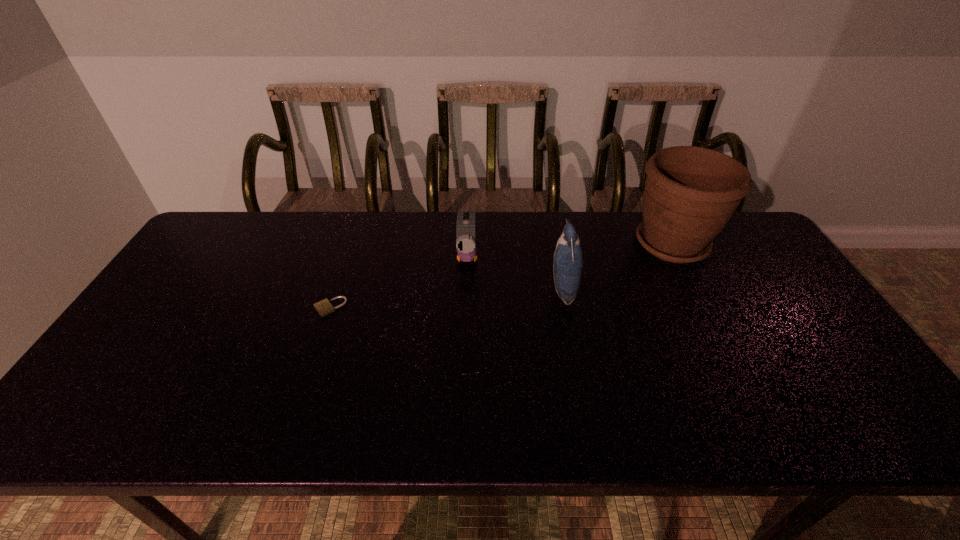
The height and width of the screenshot is (540, 960). In the image, there is a desktop. What are the coordinates of `blank space at the right edge` in the screenshot? It's located at (760, 285).

Locate an element on the screen. The image size is (960, 540). vacant space at the far right corner of the desktop is located at coordinates (726, 247).

This screenshot has height=540, width=960. What are the coordinates of `vacant space that is in between the second shortest object and the third object from left to right` in the screenshot? It's located at (515, 273).

The image size is (960, 540). In order to click on free space between the left bird and the taller bird in this screenshot , I will do `click(515, 273)`.

At what (x,y) coordinates should I click in order to perform the action: click on vacant point located between the leftmost object and the rightmost object. Please return your answer as a coordinate pair (x, y). Looking at the image, I should click on (501, 275).

Locate an element on the screen. The image size is (960, 540). free space between the right bird and the tallest object is located at coordinates (617, 266).

Image resolution: width=960 pixels, height=540 pixels. What are the coordinates of `free spot between the second tallest object and the leftmost object` in the screenshot? It's located at (446, 298).

The width and height of the screenshot is (960, 540). I want to click on vacant area that lies between the right bird and the second object from left to right, so click(x=515, y=273).

Select which object is the third closest to the tallest object. Please provide its 2D coordinates. Your answer should be formatted as a tuple, i.e. [(x, y)], where the tuple contains the x and y coordinates of a point satisfying the conditions above.

[(324, 307)]

What are the coordinates of `object that is the second closest to the padlock` in the screenshot? It's located at (568, 259).